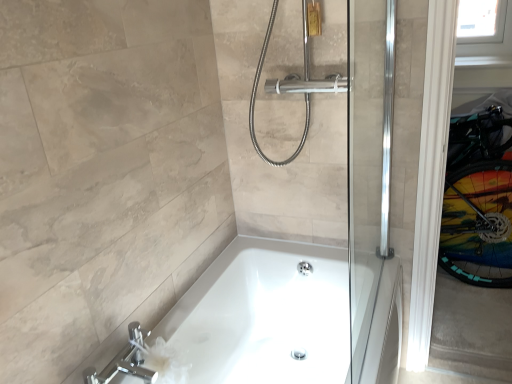
Question: From the image's perspective, is chrome/metallic faucet at lower left located above or below white glossy bathtub at center?

Choices:
 (A) below
 (B) above

Answer: (B)

Question: Is chrome/metallic faucet at lower left bigger or smaller than white glossy bathtub at center?

Choices:
 (A) small
 (B) big

Answer: (A)

Question: Which object is positioned farthest from the white glossy bathtub at center?

Choices:
 (A) chrome/metallic faucet at lower left
 (B) transparent plastic window screen at upper right

Answer: (B)

Question: Estimate the real-world distances between objects in this image. Which object is closer to the chrome/metallic faucet at lower left?

Choices:
 (A) transparent plastic window screen at upper right
 (B) white glossy bathtub at center

Answer: (B)